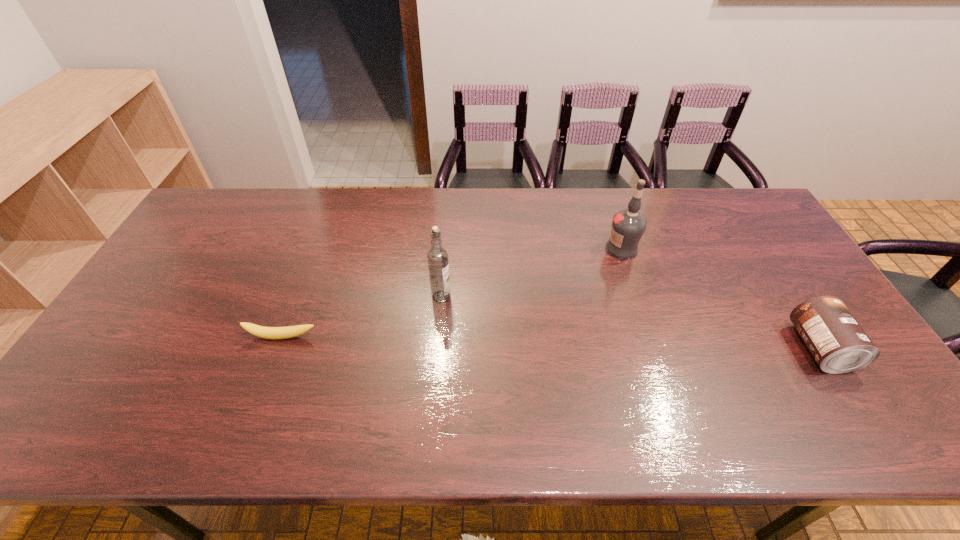
The image size is (960, 540). Find the location of `free spot between the farthest object and the banana`. free spot between the farthest object and the banana is located at coordinates (452, 293).

The width and height of the screenshot is (960, 540). Find the location of `free space between the third tallest object and the farther vodka`. free space between the third tallest object and the farther vodka is located at coordinates (720, 299).

Locate which object is the third closest to the can. Please provide its 2D coordinates. Your answer should be formatted as a tuple, i.e. [(x, y)], where the tuple contains the x and y coordinates of a point satisfying the conditions above.

[(291, 331)]

The height and width of the screenshot is (540, 960). Find the location of `object that ranks as the second closest to the second shortest object`. object that ranks as the second closest to the second shortest object is located at coordinates (437, 257).

You are a GUI agent. You are given a task and a screenshot of the screen. Output one action in this format:
    pyautogui.click(x=<x>, y=<y>)
    Task: Click on the free spot that satisfies the following two spatial constraints: 1. on the front side of the can; 2. on the front label of the second farthest object
    The height and width of the screenshot is (540, 960).
    Given the screenshot: What is the action you would take?
    pyautogui.click(x=437, y=348)

This screenshot has width=960, height=540. Identify the location of vacant area in the image that satisfies the following two spatial constraints: 1. on the front side of the can; 2. on the front label of the farther vodka. (655, 348).

Where is `blank area in the image that satisfies the following two spatial constraints: 1. on the upward curve of the leftmost object; 2. on the front label of the can`? This screenshot has width=960, height=540. blank area in the image that satisfies the following two spatial constraints: 1. on the upward curve of the leftmost object; 2. on the front label of the can is located at coordinates (278, 348).

I want to click on free space in the image that satisfies the following two spatial constraints: 1. on the upward curve of the second shortest object; 2. on the front label of the banana, so click(278, 348).

Where is `free spot that satisfies the following two spatial constraints: 1. on the upward curve of the rightmost object; 2. on the front label of the leftmost object`? This screenshot has height=540, width=960. free spot that satisfies the following two spatial constraints: 1. on the upward curve of the rightmost object; 2. on the front label of the leftmost object is located at coordinates (278, 348).

You are a GUI agent. You are given a task and a screenshot of the screen. Output one action in this format:
    pyautogui.click(x=<x>, y=<y>)
    Task: Click on the vacant point that satisfies the following two spatial constraints: 1. on the front side of the farther vodka; 2. on the front label of the second shortest object
    The image size is (960, 540).
    Given the screenshot: What is the action you would take?
    pyautogui.click(x=655, y=348)